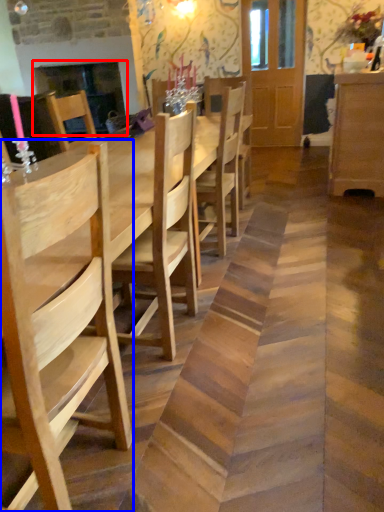
Question: Among these objects, which one is nearest to the camera, fireplace (highlighted by a red box) or chair (highlighted by a blue box)?

Choices:
 (A) fireplace
 (B) chair

Answer: (B)